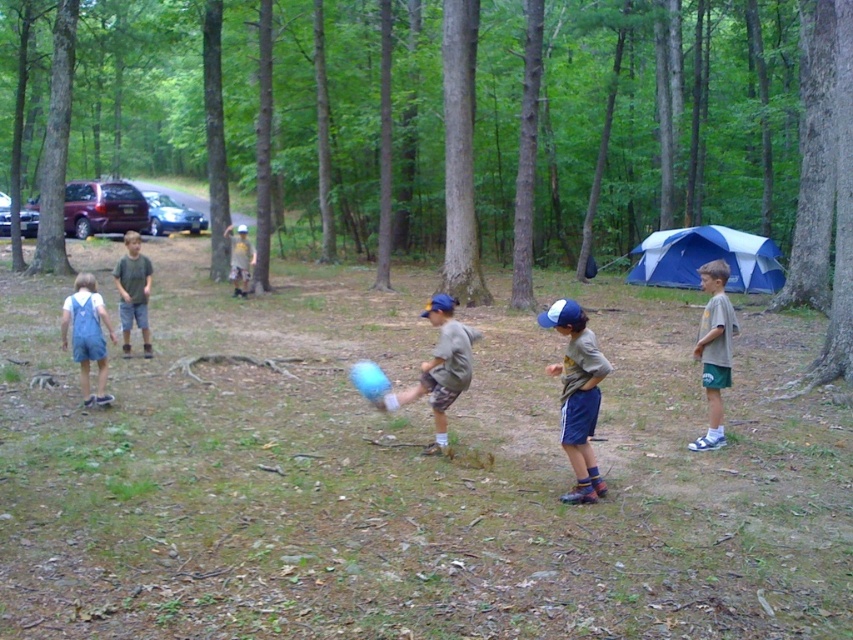
You are a photographer trying to capture a clear shot of the blue fabric cap at center and the light brown shorts at center. Which object would you focus on first if you want to ensure both are in focus, considering their sizes?

The blue fabric cap at center is thinner than light brown shorts at center, so focusing on the larger light brown shorts at center first would help ensure both are in focus.

You are a photographer trying to capture both the matte gray shirt at center and the gray cotton shirt at right in a single shot. Based on their positions, which shirt should you focus on first to ensure both are in frame?

The matte gray shirt at center is located below the gray cotton shirt at right, so you should focus on the gray cotton shirt at right first to ensure both are in frame.